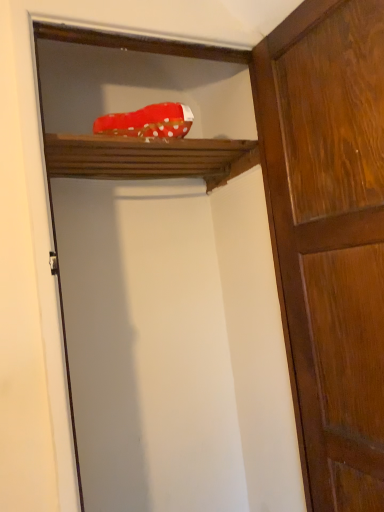
Question: Is wooden shelf at upper center shorter than shiny brown wood door at right?

Choices:
 (A) yes
 (B) no

Answer: (A)

Question: Can you confirm if wooden shelf at upper center is wider than shiny brown wood door at right?

Choices:
 (A) no
 (B) yes

Answer: (B)

Question: From a real-world perspective, is wooden shelf at upper center positioned under shiny brown wood door at right based on gravity?

Choices:
 (A) no
 (B) yes

Answer: (A)

Question: Considering the relative sizes of wooden shelf at upper center and shiny brown wood door at right in the image provided, is wooden shelf at upper center taller than shiny brown wood door at right?

Choices:
 (A) yes
 (B) no

Answer: (B)

Question: Is wooden shelf at upper center at the right side of shiny brown wood door at right?

Choices:
 (A) no
 (B) yes

Answer: (A)

Question: Considering the relative sizes of wooden shelf at upper center and shiny brown wood door at right in the image provided, is wooden shelf at upper center smaller than shiny brown wood door at right?

Choices:
 (A) no
 (B) yes

Answer: (B)

Question: From a real-world perspective, is red polka dot fabric at upper center positioned over shiny brown wood door at right based on gravity?

Choices:
 (A) no
 (B) yes

Answer: (B)

Question: From the image's perspective, is red polka dot fabric at upper center located beneath shiny brown wood door at right?

Choices:
 (A) yes
 (B) no

Answer: (B)

Question: From a real-world perspective, is red polka dot fabric at upper center under shiny brown wood door at right?

Choices:
 (A) no
 (B) yes

Answer: (A)

Question: Is red polka dot fabric at upper center at the left side of shiny brown wood door at right?

Choices:
 (A) yes
 (B) no

Answer: (A)

Question: Are red polka dot fabric at upper center and shiny brown wood door at right far apart?

Choices:
 (A) yes
 (B) no

Answer: (B)

Question: Does red polka dot fabric at upper center turn towards shiny brown wood door at right?

Choices:
 (A) no
 (B) yes

Answer: (A)

Question: Does wooden shelf at upper center come behind red polka dot fabric at upper center?

Choices:
 (A) yes
 (B) no

Answer: (A)